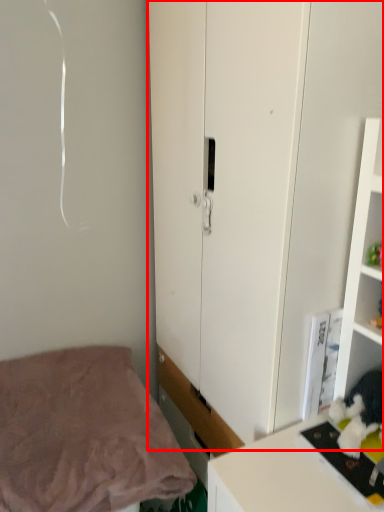
Question: Where is cupboard (annotated by the red box) located in relation to bed in the image?

Choices:
 (A) right
 (B) left

Answer: (A)